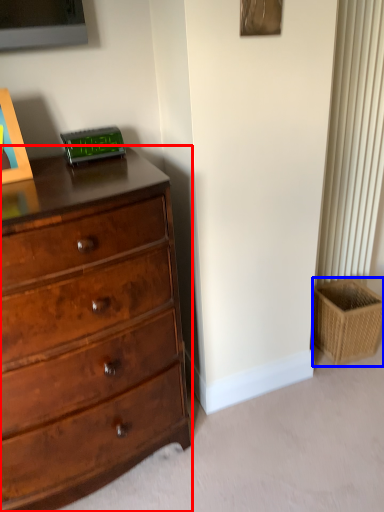
Question: Which point is closer to the camera, chest of drawers (highlighted by a red box) or basket (highlighted by a blue box)?

Choices:
 (A) chest of drawers
 (B) basket

Answer: (A)